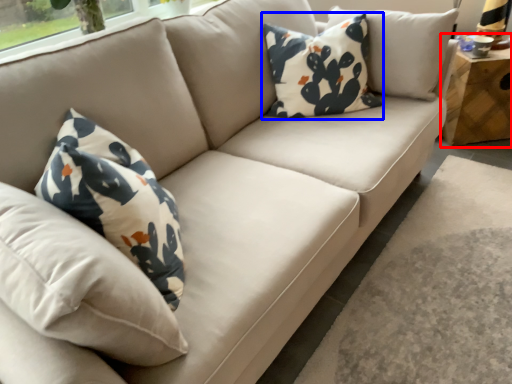
Question: Which object is further to the camera taking this photo, table (highlighted by a red box) or pillow (highlighted by a blue box)?

Choices:
 (A) table
 (B) pillow

Answer: (A)